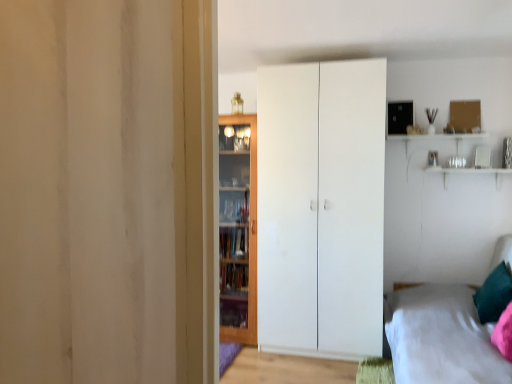
Question: Should I look upward or downward to see white fabric bed at lower right?

Choices:
 (A) down
 (B) up

Answer: (A)

Question: Can you confirm if teal velvet pillow at lower right is smaller than wooden cabinet at center?

Choices:
 (A) no
 (B) yes

Answer: (B)

Question: Considering the relative positions of teal velvet pillow at lower right and wooden cabinet at center in the image provided, is teal velvet pillow at lower right to the left of wooden cabinet at center from the viewer's perspective?

Choices:
 (A) no
 (B) yes

Answer: (A)

Question: Is wooden cabinet at center located within teal velvet pillow at lower right?

Choices:
 (A) yes
 (B) no

Answer: (B)

Question: Is teal velvet pillow at lower right positioned beyond the bounds of wooden cabinet at center?

Choices:
 (A) no
 (B) yes

Answer: (B)

Question: Does teal velvet pillow at lower right turn towards wooden cabinet at center?

Choices:
 (A) no
 (B) yes

Answer: (B)

Question: From a real-world perspective, is teal velvet pillow at lower right located higher than wooden cabinet at center?

Choices:
 (A) no
 (B) yes

Answer: (A)

Question: Considering the relative sizes of white fabric bed at lower right and white matte wardrobe at center in the image provided, is white fabric bed at lower right taller than white matte wardrobe at center?

Choices:
 (A) no
 (B) yes

Answer: (A)

Question: From a real-world perspective, is white fabric bed at lower right on white matte wardrobe at center?

Choices:
 (A) no
 (B) yes

Answer: (A)

Question: Would you say white fabric bed at lower right is outside white matte wardrobe at center?

Choices:
 (A) yes
 (B) no

Answer: (A)

Question: Is white fabric bed at lower right far away from white matte wardrobe at center?

Choices:
 (A) no
 (B) yes

Answer: (A)

Question: Does white fabric bed at lower right turn towards white matte wardrobe at center?

Choices:
 (A) no
 (B) yes

Answer: (A)

Question: Is white fabric bed at lower right further to the viewer compared to white matte wardrobe at center?

Choices:
 (A) yes
 (B) no

Answer: (B)

Question: From a real-world perspective, is white fabric bed at lower right positioned under teal velvet pillow at lower right based on gravity?

Choices:
 (A) no
 (B) yes

Answer: (B)